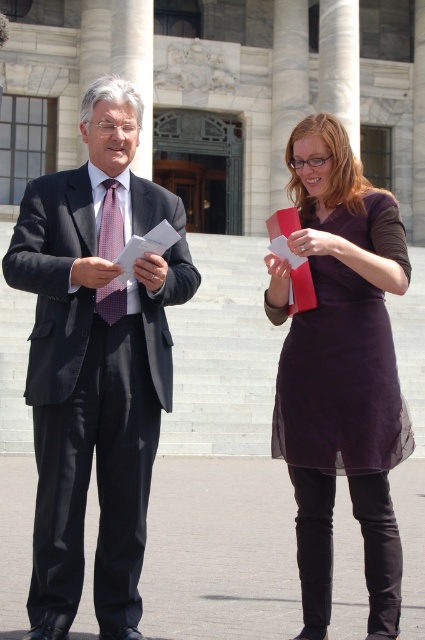
Question: Does matte black suit at left have a larger size compared to matte purple dress at center?

Choices:
 (A) yes
 (B) no

Answer: (A)

Question: In this image, where is matte black suit at left located relative to checkered fabric tie at center?

Choices:
 (A) below
 (B) above

Answer: (A)

Question: Does matte black suit at left have a greater width compared to matte purple dress at center?

Choices:
 (A) yes
 (B) no

Answer: (A)

Question: Which point is closer to the camera?

Choices:
 (A) [x=108, y=250]
 (B) [x=387, y=456]

Answer: (B)

Question: Which point is farther from the camera taking this photo?

Choices:
 (A) (108, 202)
 (B) (113, 353)

Answer: (A)

Question: Which of the following is the closest to the observer?

Choices:
 (A) (98, 129)
 (B) (108, 304)
 (C) (308, 220)

Answer: (B)